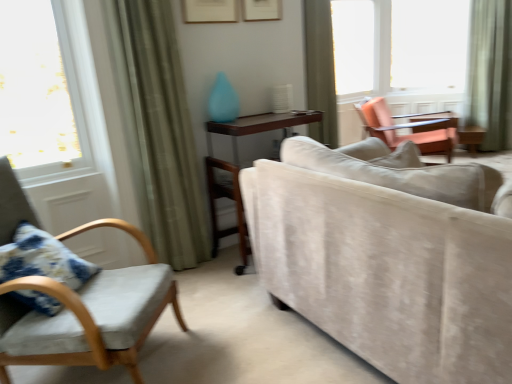
Question: Is beige velvet couch at center bigger than green fabric curtain at right, the first curtain positioned from the back?

Choices:
 (A) yes
 (B) no

Answer: (A)

Question: From the image's perspective, is beige velvet couch at center over green fabric curtain at right, arranged as the 3th curtain when viewed from the left?

Choices:
 (A) yes
 (B) no

Answer: (B)

Question: Does beige velvet couch at center have a greater width compared to green fabric curtain at right, arranged as the 3th curtain when viewed from the left?

Choices:
 (A) no
 (B) yes

Answer: (B)

Question: Does beige velvet couch at center have a smaller size compared to green fabric curtain at right, which is the 1th curtain in right-to-left order?

Choices:
 (A) yes
 (B) no

Answer: (B)

Question: Is green fabric curtain at right, placed as the 3th curtain when sorted from front to back, surrounded by beige velvet couch at center?

Choices:
 (A) yes
 (B) no

Answer: (B)

Question: From the image's perspective, is velvet cushioned chair at left, which is the 2th chair in top-to-bottom order, located above or below matte orange chair at upper right, positioned as the 1th chair in top-to-bottom order?

Choices:
 (A) below
 (B) above

Answer: (A)

Question: Is point (62, 297) closer or farther from the camera than point (437, 140)?

Choices:
 (A) farther
 (B) closer

Answer: (B)

Question: In the image, is velvet cushioned chair at left, marked as the 2th chair in a right-to-left arrangement, positioned in front of or behind matte orange chair at upper right, positioned as the 2th chair in bottom-to-top order?

Choices:
 (A) behind
 (B) front

Answer: (B)

Question: From a real-world perspective, is velvet cushioned chair at left, the 2th chair positioned from the back, physically located above or below matte orange chair at upper right, positioned as the 2th chair in bottom-to-top order?

Choices:
 (A) above
 (B) below

Answer: (A)

Question: Is wooden table at center bigger or smaller than transparent glass window at upper right, which appears as the second window when viewed from the right?

Choices:
 (A) big
 (B) small

Answer: (A)

Question: Considering the positions of wooden table at center and transparent glass window at upper right, which appears as the second window when viewed from the right, in the image, is wooden table at center taller or shorter than transparent glass window at upper right, which appears as the second window when viewed from the right,?

Choices:
 (A) tall
 (B) short

Answer: (B)

Question: Is wooden table at center to the left or to the right of transparent glass window at upper right, which appears as the 1th window when viewed from the left, in the image?

Choices:
 (A) right
 (B) left

Answer: (B)

Question: From the image's perspective, is wooden table at center above or below transparent glass window at upper right, which appears as the 1th window when viewed from the left?

Choices:
 (A) above
 (B) below

Answer: (B)

Question: Is green fabric curtain at left, which is the 1th curtain in front-to-back order, situated inside transparent glass window at upper right, marked as the first window in a right-to-left arrangement, or outside?

Choices:
 (A) inside
 (B) outside

Answer: (B)

Question: In the image, is green fabric curtain at left, the 1th curtain positioned from the left, on the left side or the right side of transparent glass window at upper right, marked as the first window in a right-to-left arrangement?

Choices:
 (A) left
 (B) right

Answer: (A)